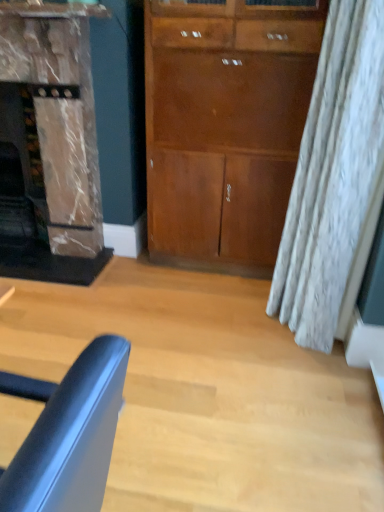
Question: From the image's perspective, is matte wood cabinet at center located above or below matte brown fireplace at left?

Choices:
 (A) below
 (B) above

Answer: (A)

Question: Do you think matte wood cabinet at center is within matte brown fireplace at left, or outside of it?

Choices:
 (A) inside
 (B) outside

Answer: (B)

Question: Based on their relative distances, which object is farther from the matte blue chair at lower left?

Choices:
 (A) matte brown fireplace at left
 (B) matte wood cabinet at center

Answer: (A)

Question: Which object is the closest to the matte wood cabinet at center?

Choices:
 (A) matte brown fireplace at left
 (B) matte blue chair at lower left

Answer: (A)